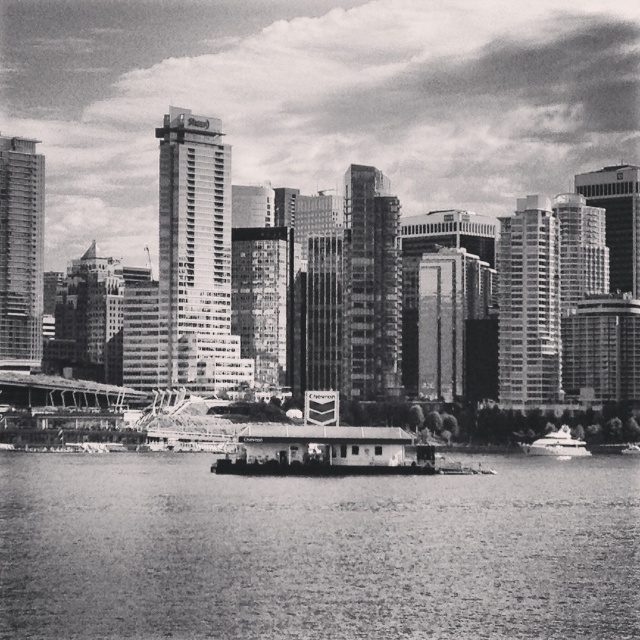
Which is more to the right, smooth water at center or white glossy boat at lower right?

white glossy boat at lower right is more to the right.

Does smooth water at center have a larger size compared to white glossy boat at lower right?

Indeed, smooth water at center has a larger size compared to white glossy boat at lower right.

Who is more forward, (252, 588) or (532, 440)?

Point (252, 588) is more forward.

Find the location of a particular element. This screenshot has height=640, width=640. smooth water at center is located at coordinates (316, 552).